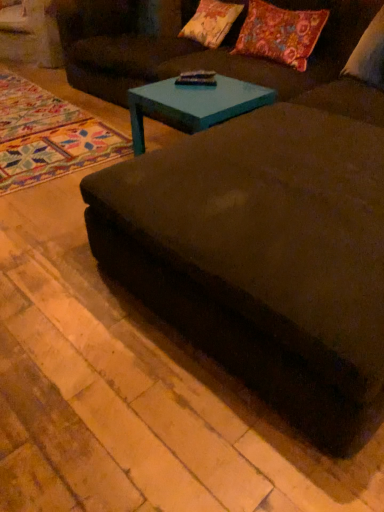
Question: Can you confirm if floral fabric pillow at upper right, which is the second pillow in right-to-left order, is shorter than multicolored woven rug at lower left?

Choices:
 (A) yes
 (B) no

Answer: (B)

Question: From a real-world perspective, is floral fabric pillow at upper right, which is the second pillow in right-to-left order, positioned under multicolored woven rug at lower left based on gravity?

Choices:
 (A) no
 (B) yes

Answer: (A)

Question: Can you confirm if floral fabric pillow at upper right, which ranks as the 2th pillow in left-to-right order, is positioned to the left of multicolored woven rug at lower left?

Choices:
 (A) no
 (B) yes

Answer: (A)

Question: Is floral fabric pillow at upper right, which ranks as the 2th pillow in left-to-right order, taller than multicolored woven rug at lower left?

Choices:
 (A) no
 (B) yes

Answer: (B)

Question: Does floral fabric pillow at upper right, which ranks as the 2th pillow in left-to-right order, turn towards multicolored woven rug at lower left?

Choices:
 (A) yes
 (B) no

Answer: (B)

Question: From the image's perspective, is floral fabric pillow at upper center, marked as the 3th pillow in a right-to-left arrangement, positioned above or below velvet dark brown couch at center?

Choices:
 (A) above
 (B) below

Answer: (A)

Question: Would you say floral fabric pillow at upper center, marked as the 3th pillow in a right-to-left arrangement, is inside or outside velvet dark brown couch at center?

Choices:
 (A) inside
 (B) outside

Answer: (B)

Question: In terms of height, does floral fabric pillow at upper center, marked as the 3th pillow in a right-to-left arrangement, look taller or shorter compared to velvet dark brown couch at center?

Choices:
 (A) tall
 (B) short

Answer: (B)

Question: Is point (192, 17) positioned closer to the camera than point (306, 227)?

Choices:
 (A) farther
 (B) closer

Answer: (A)

Question: In terms of width, does multicolored woven rug at lower left look wider or thinner when compared to teal glossy coffee table at center?

Choices:
 (A) thin
 (B) wide

Answer: (B)

Question: Would you say multicolored woven rug at lower left is to the left or to the right of teal glossy coffee table at center in the picture?

Choices:
 (A) right
 (B) left

Answer: (B)

Question: Considering their positions, is multicolored woven rug at lower left located in front of or behind teal glossy coffee table at center?

Choices:
 (A) front
 (B) behind

Answer: (B)

Question: From a real-world perspective, is multicolored woven rug at lower left physically located above or below teal glossy coffee table at center?

Choices:
 (A) below
 (B) above

Answer: (A)

Question: Choose the correct answer: Is white soft pillow at upper right, acting as the first pillow starting from the right, inside floral fabric pillow at upper center, which appears as the 1th pillow when viewed from the left, or outside it?

Choices:
 (A) outside
 (B) inside

Answer: (A)

Question: Relative to floral fabric pillow at upper center, which appears as the 1th pillow when viewed from the left, is white soft pillow at upper right, acting as the first pillow starting from the right, in front or behind?

Choices:
 (A) front
 (B) behind

Answer: (A)